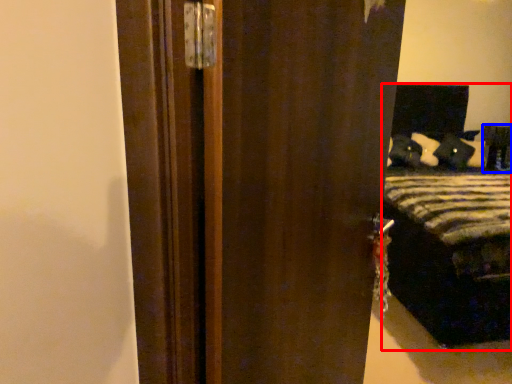
Question: Among these objects, which one is farthest to the camera, bed (highlighted by a red box) or furniture (highlighted by a blue box)?

Choices:
 (A) bed
 (B) furniture

Answer: (B)